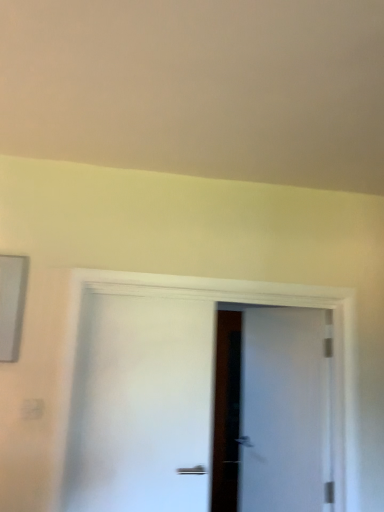
Measure the distance between point (286, 328) and camera.

2.66 meters.

Identify the location of white matte door at center, which is the second door from front to back. This screenshot has width=384, height=512. (272, 411).

What is the approximate height of white matte door at center, which is the second door from front to back?

The height of white matte door at center, which is the second door from front to back, is 1.33 meters.

The width and height of the screenshot is (384, 512). What do you see at coordinates (272, 411) in the screenshot? I see `white matte door at center, the 1th door viewed from the back` at bounding box center [272, 411].

What is the approximate width of white matte door at center, which is the second door from front to back?

white matte door at center, which is the second door from front to back, is 4.44 inches wide.

Describe the element at coordinates (140, 405) in the screenshot. This screenshot has width=384, height=512. I see `white matte door at center, which is the 2th door from right to left` at that location.

This screenshot has width=384, height=512. Find the location of `white matte door at center, the first door when ordered from front to back`. white matte door at center, the first door when ordered from front to back is located at coordinates (140, 405).

This screenshot has height=512, width=384. I want to click on white matte door at center, which is the second door from front to back, so click(272, 411).

Which object is positioned more to the left, white matte door at center, which is the 2th door from left to right, or white matte door at center, the first door in the left-to-right sequence?

white matte door at center, the first door in the left-to-right sequence, is more to the left.

Is white matte door at center, the 1th door viewed from the back, closer to camera compared to white matte door at center, the first door when ordered from front to back?

No, white matte door at center, the 1th door viewed from the back, is further to the viewer.

Which point is more distant from viewer, (291, 479) or (105, 331)?

The point (291, 479) is farther from the camera.

From the image's perspective, is white matte door at center, which is the second door from front to back, above white matte door at center, the first door in the left-to-right sequence?

Incorrect, from the image's perspective, white matte door at center, which is the second door from front to back, is lower than white matte door at center, the first door in the left-to-right sequence.

From a real-world perspective, is white matte door at center, which is the second door from front to back, below white matte door at center, the first door in the left-to-right sequence?

Yes.

Considering the relative sizes of white matte door at center, the 1th door viewed from the back, and white matte door at center, which is the 2th door from right to left, in the image provided, is white matte door at center, the 1th door viewed from the back, thinner than white matte door at center, which is the 2th door from right to left,?

No, white matte door at center, the 1th door viewed from the back, is not thinner than white matte door at center, which is the 2th door from right to left.

Can you confirm if white matte door at center, acting as the first door starting from the right, is shorter than white matte door at center, the first door when ordered from front to back?

Incorrect, the height of white matte door at center, acting as the first door starting from the right, does not fall short of that of white matte door at center, the first door when ordered from front to back.

Is white matte door at center, which is the second door from front to back, smaller than white matte door at center, the first door when ordered from front to back?

Actually, white matte door at center, which is the second door from front to back, might be larger than white matte door at center, the first door when ordered from front to back.

Can we say white matte door at center, the 1th door viewed from the back, lies outside white matte door at center, the first door in the left-to-right sequence?

Indeed, white matte door at center, the 1th door viewed from the back, is completely outside white matte door at center, the first door in the left-to-right sequence.

Is there a large distance between white matte door at center, the 1th door viewed from the back, and white matte door at center, the first door in the left-to-right sequence?

They are positioned close to each other.

Is white matte door at center, which is counted as the 2th door, starting from the back, at the back of white matte door at center, the 1th door viewed from the back?

Correct, white matte door at center, the 1th door viewed from the back, is looking away from white matte door at center, which is counted as the 2th door, starting from the back.

How many degrees apart are the facing directions of white matte door at center, which is the 2th door from left to right, and white matte door at center, the first door when ordered from front to back?

67.9 degrees separate the facing orientations of white matte door at center, which is the 2th door from left to right, and white matte door at center, the first door when ordered from front to back.

Image resolution: width=384 pixels, height=512 pixels. Find the location of `door that appears in front of the white matte door at center, which is the 2th door from left to right`. door that appears in front of the white matte door at center, which is the 2th door from left to right is located at coordinates (140, 405).

Is white matte door at center, which is counted as the 2th door, starting from the back, at the left side of white matte door at center, the 1th door viewed from the back?

Yes.

Between white matte door at center, which is counted as the 2th door, starting from the back, and white matte door at center, acting as the first door starting from the right, which one is positioned in front?

white matte door at center, which is counted as the 2th door, starting from the back, is more forward.

Does point (137, 398) come farther from viewer compared to point (225, 429)?

No, (137, 398) is in front of (225, 429).

Based on the photo, from the image's perspective, relative to white matte door at center, the 1th door viewed from the back, is white matte door at center, which is the 2th door from right to left, above or below?

Based on their image positions, white matte door at center, which is the 2th door from right to left, is located above white matte door at center, the 1th door viewed from the back.

From a real-world perspective, who is located lower, white matte door at center, which is the 2th door from right to left, or white matte door at center, acting as the first door starting from the right?

From a 3D spatial view, white matte door at center, acting as the first door starting from the right, is below.

Is white matte door at center, which is the 2th door from right to left, wider than white matte door at center, the 1th door viewed from the back?

Incorrect, the width of white matte door at center, which is the 2th door from right to left, does not surpass that of white matte door at center, the 1th door viewed from the back.

Is white matte door at center, which is counted as the 2th door, starting from the back, taller or shorter than white matte door at center, which is the 2th door from left to right?

In the image, white matte door at center, which is counted as the 2th door, starting from the back, appears to be shorter than white matte door at center, which is the 2th door from left to right.

Which of these two, white matte door at center, the first door in the left-to-right sequence, or white matte door at center, which is the 2th door from left to right, is smaller?

white matte door at center, the first door in the left-to-right sequence, is smaller.

Is white matte door at center, which is counted as the 2th door, starting from the back, not inside white matte door at center, the 1th door viewed from the back?

Absolutely, white matte door at center, which is counted as the 2th door, starting from the back, is external to white matte door at center, the 1th door viewed from the back.

Are white matte door at center, the first door in the left-to-right sequence, and white matte door at center, the 1th door viewed from the back, located far from each other?

No.

Could you tell me if white matte door at center, which is the 2th door from right to left, is facing white matte door at center, which is the 2th door from left to right?

No, white matte door at center, which is the 2th door from right to left, is not oriented towards white matte door at center, which is the 2th door from left to right.

The width and height of the screenshot is (384, 512). In order to click on door to the right of white matte door at center, the first door when ordered from front to back in this screenshot , I will do `click(272, 411)`.

Locate an element on the screen. door above the white matte door at center, which is the 2th door from left to right (from a real-world perspective) is located at coordinates (140, 405).

Identify the location of door in front of the white matte door at center, acting as the first door starting from the right. Image resolution: width=384 pixels, height=512 pixels. (140, 405).